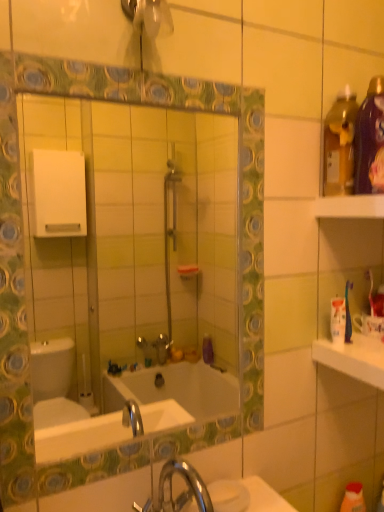
Identify the location of blank space situated above green glossy mirror at center (from a real-world perspective). (129, 67).